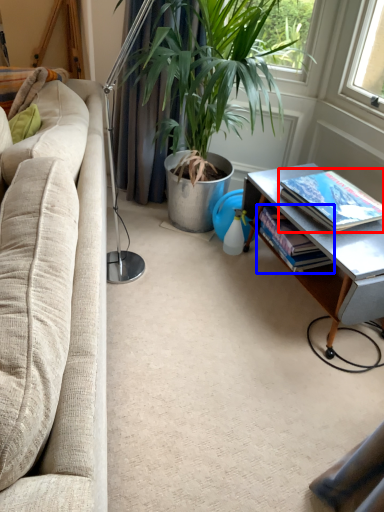
Question: Which object appears farthest to the camera in this image, book (highlighted by a red box) or book (highlighted by a blue box)?

Choices:
 (A) book
 (B) book

Answer: (B)